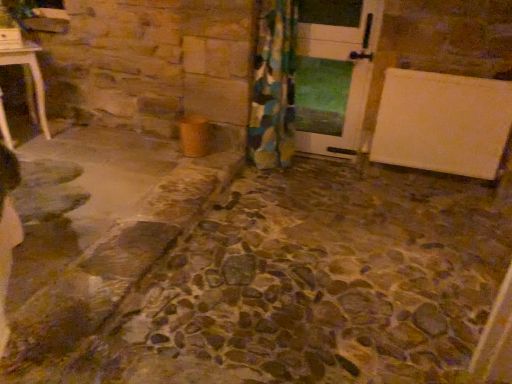
Question: From the image's perspective, is floral fabric curtain at center positioned above or below white glossy door at center?

Choices:
 (A) above
 (B) below

Answer: (B)

Question: Considering the positions of point (275, 69) and point (368, 6), is point (275, 69) closer or farther from the camera than point (368, 6)?

Choices:
 (A) farther
 (B) closer

Answer: (A)

Question: Is floral fabric curtain at center to the left or to the right of white glossy door at center in the image?

Choices:
 (A) left
 (B) right

Answer: (A)

Question: Relative to floral fabric curtain at center, is white glossy door at center in front or behind?

Choices:
 (A) behind
 (B) front

Answer: (A)

Question: Visually, is white glossy door at center positioned to the left or to the right of floral fabric curtain at center?

Choices:
 (A) right
 (B) left

Answer: (A)

Question: In terms of size, does white glossy door at center appear bigger or smaller than floral fabric curtain at center?

Choices:
 (A) big
 (B) small

Answer: (B)

Question: Considering the positions of white glossy door at center and floral fabric curtain at center in the image, is white glossy door at center taller or shorter than floral fabric curtain at center?

Choices:
 (A) short
 (B) tall

Answer: (A)